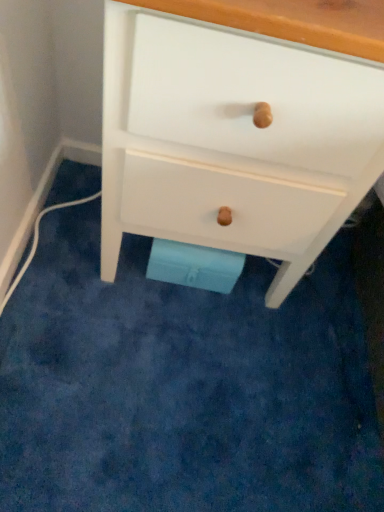
From the picture: Measure the distance between white matte chest of drawers at center and camera.

white matte chest of drawers at center and camera are 44.72 centimeters apart from each other.

This screenshot has height=512, width=384. What do you see at coordinates (239, 128) in the screenshot?
I see `white matte chest of drawers at center` at bounding box center [239, 128].

Where is `white matte chest of drawers at center`? white matte chest of drawers at center is located at coordinates click(239, 128).

Where is `white matte chest of drawers at center`? This screenshot has width=384, height=512. white matte chest of drawers at center is located at coordinates (239, 128).